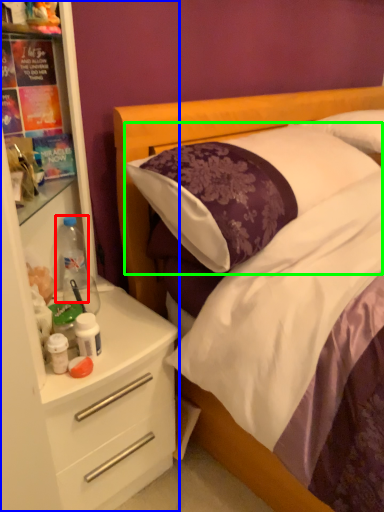
Question: Estimate the real-world distances between objects in this image. Which object is closer to bottle (highlighted by a red box), dresser (highlighted by a blue box) or pillow (highlighted by a green box)?

Choices:
 (A) dresser
 (B) pillow

Answer: (A)